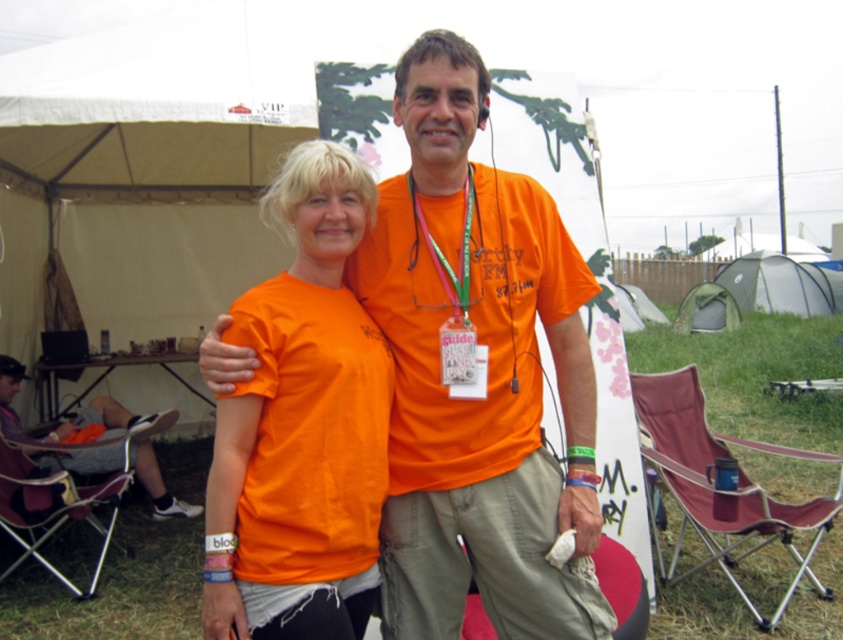
Is matte orange t-shirt at center to the right of orange matte t-shirt at center from the viewer's perspective?

Indeed, matte orange t-shirt at center is positioned on the right side of orange matte t-shirt at center.

Who is taller, matte orange t-shirt at center or orange matte t-shirt at center?

With more height is matte orange t-shirt at center.

Identify the location of matte orange t-shirt at center. (482, 410).

Who is taller, green fabric tent at right or orange fabric at center?

green fabric tent at right is taller.

Is point (831, 304) behind point (443, 157)?

Yes, point (831, 304) is behind point (443, 157).

Is point (793, 300) positioned after point (432, 140)?

Yes, it is.

I want to click on green fabric tent at right, so click(781, 284).

Between green fabric tent at center and orange matte neck at center, which one is positioned higher?

green fabric tent at center is higher up.

Is green fabric tent at center to the right of orange matte neck at center from the viewer's perspective?

Yes, green fabric tent at center is to the right of orange matte neck at center.

This screenshot has height=640, width=843. What are the coordinates of `green fabric tent at center` in the screenshot? It's located at (707, 308).